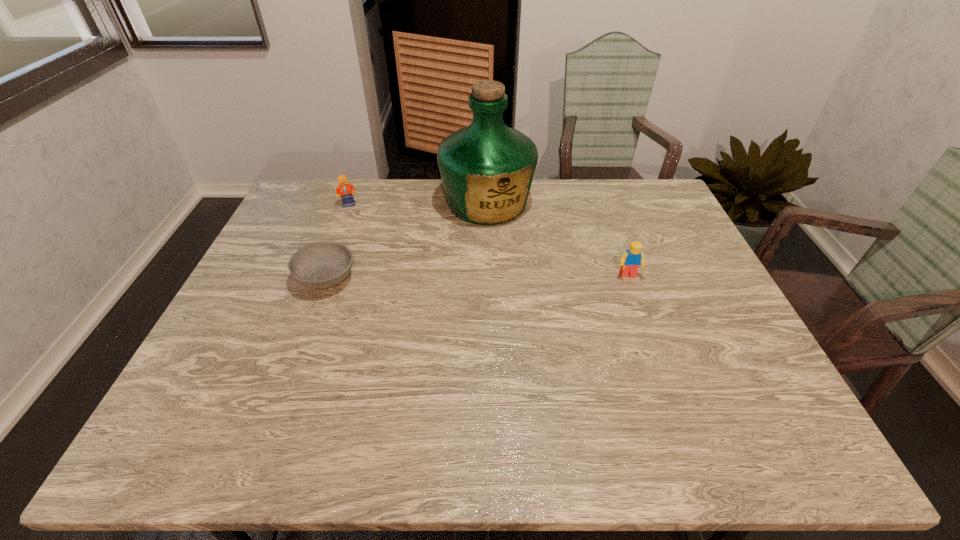
You are a GUI agent. You are given a task and a screenshot of the screen. Output one action in this format:
    pyautogui.click(x=<x>, y=<y>)
    Task: Click on the free spot on the desktop that is between the bowl and the right Lego and is positioned on the front-facing side of the left Lego
    
    Given the screenshot: What is the action you would take?
    pyautogui.click(x=434, y=277)

You are a GUI agent. You are given a task and a screenshot of the screen. Output one action in this format:
    pyautogui.click(x=<x>, y=<y>)
    Task: Click on the vacant space on the desktop that is between the shortest object and the nearer Lego and is positioned on the label side of the liquor
    The image size is (960, 540).
    Given the screenshot: What is the action you would take?
    pyautogui.click(x=516, y=276)